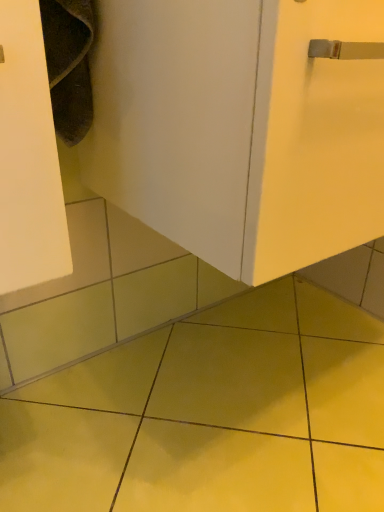
Question: Is yellow glossy tile at center in front of or behind white matte door at center in the image?

Choices:
 (A) front
 (B) behind

Answer: (B)

Question: Which is correct: yellow glossy tile at center is inside white matte door at center, or outside of it?

Choices:
 (A) outside
 (B) inside

Answer: (A)

Question: From a real-world perspective, relative to white matte door at center, is yellow glossy tile at center vertically above or below?

Choices:
 (A) below
 (B) above

Answer: (A)

Question: In terms of height, does white matte door at center look taller or shorter compared to yellow glossy tile at center?

Choices:
 (A) tall
 (B) short

Answer: (A)

Question: In terms of size, does white matte door at center appear bigger or smaller than yellow glossy tile at center?

Choices:
 (A) big
 (B) small

Answer: (A)

Question: From a real-world perspective, is white matte door at center positioned above or below yellow glossy tile at center?

Choices:
 (A) above
 (B) below

Answer: (A)

Question: Visually, is white matte door at center positioned to the left or to the right of yellow glossy tile at center?

Choices:
 (A) left
 (B) right

Answer: (B)